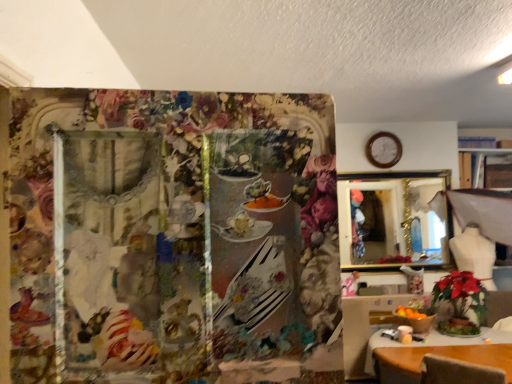
Where is `gold-framed mirror at upper right`? Image resolution: width=512 pixels, height=384 pixels. gold-framed mirror at upper right is located at coordinates (392, 221).

This screenshot has height=384, width=512. Identify the location of green leafy plant at lower right. (460, 301).

What is the approximate height of wooden table at lower right, which is the second table in front-to-back order?

It is 25.47 inches.

This screenshot has width=512, height=384. What do you see at coordinates (384, 150) in the screenshot?
I see `wooden clock at upper right` at bounding box center [384, 150].

Locate an element on the screen. This screenshot has width=512, height=384. gold-framed mirror at upper right is located at coordinates (392, 221).

From the image's perspective, is wooden table at lower right, which is the second table in front-to-back order, over wooden clock at upper right?

No, from the image's perspective, wooden table at lower right, which is the second table in front-to-back order, is not above wooden clock at upper right.

Is wooden table at lower right, which is counted as the 1th table, starting from the back, positioned with its back to wooden clock at upper right?

No, wooden table at lower right, which is counted as the 1th table, starting from the back, is not facing away from wooden clock at upper right.

Considering the points (378, 312) and (390, 155), which point is behind, point (378, 312) or point (390, 155)?

The point (390, 155) is more distant.

From a real-world perspective, does wooden table at lower right, arranged as the second table when viewed from the left, sit lower than green leafy plant at lower right?

Indeed, from a real-world perspective, wooden table at lower right, arranged as the second table when viewed from the left, is positioned beneath green leafy plant at lower right.

Where is `houseplant above the wooden table at lower right, placed as the 1th table when sorted from right to left (from the image's perspective)`? This screenshot has height=384, width=512. houseplant above the wooden table at lower right, placed as the 1th table when sorted from right to left (from the image's perspective) is located at coordinates (460, 301).

Would you say wooden table at lower right, arranged as the second table when viewed from the back, contains green leafy plant at lower right?

Definitely not — green leafy plant at lower right is not inside wooden table at lower right, arranged as the second table when viewed from the back.

Is wooden table at lower right, arranged as the second table when viewed from the left, far away from green leafy plant at lower right?

No, wooden table at lower right, arranged as the second table when viewed from the left, is not far away from green leafy plant at lower right.

Is point (380, 330) closer or farther from the camera than point (402, 231)?

Point (380, 330) appears to be closer to the viewer than point (402, 231).

From the image's perspective, is wooden table at lower right, which is the first table from front to back, below gold-framed mirror at upper right?

Yes.

The width and height of the screenshot is (512, 384). I want to click on mirror behind the wooden table at lower right, arranged as the second table when viewed from the back, so click(392, 221).

Is wooden table at lower right, arranged as the second table when viewed from the left, looking in the opposite direction of gold-framed mirror at upper right?

wooden table at lower right, arranged as the second table when viewed from the left, does not have its back to gold-framed mirror at upper right.

The image size is (512, 384). I want to click on houseplant that appears in front of the wooden clock at upper right, so click(460, 301).

From the image's perspective, which is below, green leafy plant at lower right or wooden clock at upper right?

green leafy plant at lower right is shown below in the image.

Which of these two, green leafy plant at lower right or wooden clock at upper right, is wider?

green leafy plant at lower right is wider.

From a real-world perspective, between gold-framed mirror at upper right and green leafy plant at lower right, who is vertically higher?

gold-framed mirror at upper right is physically above.

Which point is more forward, [393,201] or [461,289]?

The point [461,289] is closer to the camera.

Is green leafy plant at lower right inside gold-framed mirror at upper right?

No, gold-framed mirror at upper right does not contain green leafy plant at lower right.

Which object is thinner, gold-framed mirror at upper right or green leafy plant at lower right?

Thinner between the two is gold-framed mirror at upper right.

The image size is (512, 384). I want to click on clock behind the wooden table at lower right, placed as the 1th table when sorted from right to left, so pyautogui.click(x=384, y=150).

Is wooden clock at upper right wider or thinner than wooden table at lower right, which is the first table from front to back?

Considering their sizes, wooden clock at upper right looks slimmer than wooden table at lower right, which is the first table from front to back.

Which object is positioned more to the right, wooden clock at upper right or wooden table at lower right, which is the first table from front to back?

wooden table at lower right, which is the first table from front to back, is more to the right.

From a real-world perspective, which is physically above, wooden clock at upper right or wooden table at lower right, placed as the 1th table when sorted from right to left?

From a 3D spatial view, wooden clock at upper right is above.

Is point (405, 236) positioned in front of point (433, 339)?

No, (405, 236) is behind (433, 339).

Is gold-framed mirror at upper right to the right of wooden table at lower right, arranged as the second table when viewed from the left, from the viewer's perspective?

Yes, gold-framed mirror at upper right is to the right of wooden table at lower right, arranged as the second table when viewed from the left.

Starting from the gold-framed mirror at upper right, which table is the 2nd one in front? Please provide its 2D coordinates.

[(432, 342)]

Relative to wooden table at lower right, arranged as the second table when viewed from the back, is gold-framed mirror at upper right in front or behind?

gold-framed mirror at upper right is behind wooden table at lower right, arranged as the second table when viewed from the back.

The height and width of the screenshot is (384, 512). Find the location of `clock that appears above the wooden table at lower right, which is the second table in front-to-back order (from the image's perspective)`. clock that appears above the wooden table at lower right, which is the second table in front-to-back order (from the image's perspective) is located at coordinates (384, 150).

Locate an element on the screen. This screenshot has height=384, width=512. table that is the 1st one when counting leftward from the green leafy plant at lower right is located at coordinates (432, 342).

Considering their positions, is wooden table at lower right, arranged as the second table when viewed from the left, positioned closer to gold-framed mirror at upper right than wooden clock at upper right?

The object closer to gold-framed mirror at upper right is wooden clock at upper right.

Which object lies nearer to the anchor point wooden clock at upper right, gold-framed mirror at upper right or green leafy plant at lower right?

gold-framed mirror at upper right is closer to wooden clock at upper right.

Estimate the real-world distances between objects in this image. Which object is closer to wooden table at lower right, arranged as the second table when viewed from the back, green leafy plant at lower right or wooden table at lower right, which is counted as the 1th table, starting from the back?

The object closer to wooden table at lower right, arranged as the second table when viewed from the back, is wooden table at lower right, which is counted as the 1th table, starting from the back.

When comparing their distances from wooden clock at upper right, does green leafy plant at lower right or wooden table at lower right, which is the first table from front to back, seem closer?

The object closer to wooden clock at upper right is green leafy plant at lower right.

When comparing their distances from wooden table at lower right, which is counted as the 1th table, starting from the back, does green leafy plant at lower right or gold-framed mirror at upper right seem closer?

green leafy plant at lower right is positioned closer to the anchor wooden table at lower right, which is counted as the 1th table, starting from the back.

From the image, which object appears to be nearer to wooden table at lower right, which is the first table in left-to-right order, gold-framed mirror at upper right or green leafy plant at lower right?

green leafy plant at lower right.

Estimate the real-world distances between objects in this image. Which object is closer to wooden table at lower right, which is the first table from front to back, wooden clock at upper right or green leafy plant at lower right?

green leafy plant at lower right lies closer to wooden table at lower right, which is the first table from front to back, than the other object.

Estimate the real-world distances between objects in this image. Which object is closer to green leafy plant at lower right, gold-framed mirror at upper right or wooden clock at upper right?

Based on the image, gold-framed mirror at upper right appears to be nearer to green leafy plant at lower right.

Identify the location of mirror between wooden clock at upper right and green leafy plant at lower right vertically. The image size is (512, 384). (392, 221).

At what (x,y) coordinates should I click in order to perform the action: click on table between wooden table at lower right, which is the first table from front to back, and green leafy plant at lower right in the front-back direction. Please return your answer as a coordinate pair (x, y). Image resolution: width=512 pixels, height=384 pixels. Looking at the image, I should click on (365, 328).

Locate an element on the screen. mirror between wooden clock at upper right and wooden table at lower right, which is counted as the 1th table, starting from the back, from top to bottom is located at coordinates (392, 221).

You are a GUI agent. You are given a task and a screenshot of the screen. Output one action in this format:
    pyautogui.click(x=<x>, y=<y>)
    Task: Click on the mirror located between wooden table at lower right, which is the first table from front to back, and wooden clock at upper right in the depth direction
    
    Given the screenshot: What is the action you would take?
    pyautogui.click(x=392, y=221)